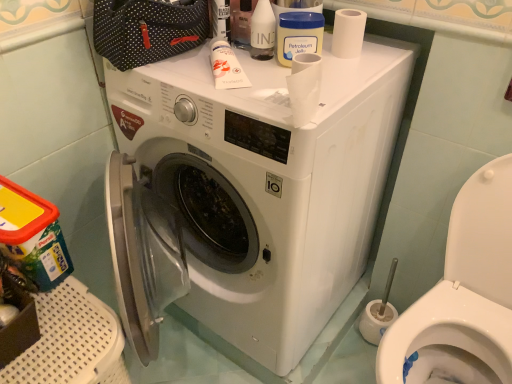
Locate an element on the screen. vacant space to the right of white matte tube at upper center, the 2th toiletry when ordered from top to bottom is located at coordinates (288, 74).